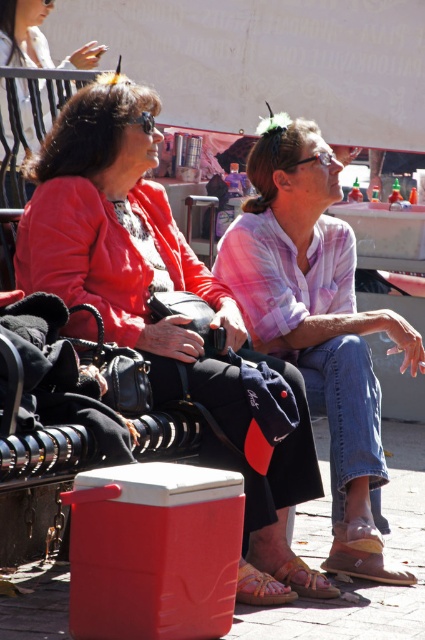
You are a photographer trying to capture a closeup shot of the brown leather sandal at lower center without including the denim jeans at center in the frame. Given their relative heights, is this possible?

The denim jeans at center has a greater height compared to brown leather sandal at lower center. Since the jeans are taller, they might block the view of the sandal. However, by adjusting the camera angle to focus lower, it could be possible to exclude the jeans from the frame while capturing the sandal.

In the scene shown: You are standing at the origin point of the coordinate system. You see a point labeled as point (125, 244). What object is located at that point?

The point (125, 244) corresponds to the matte black jacket at center.